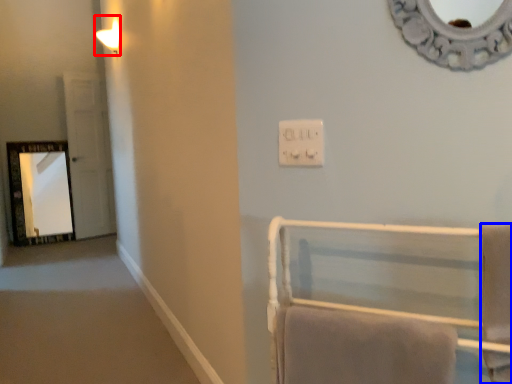
Question: Which object is closer to the camera taking this photo, light fixture (highlighted by a red box) or bath towel (highlighted by a blue box)?

Choices:
 (A) light fixture
 (B) bath towel

Answer: (B)